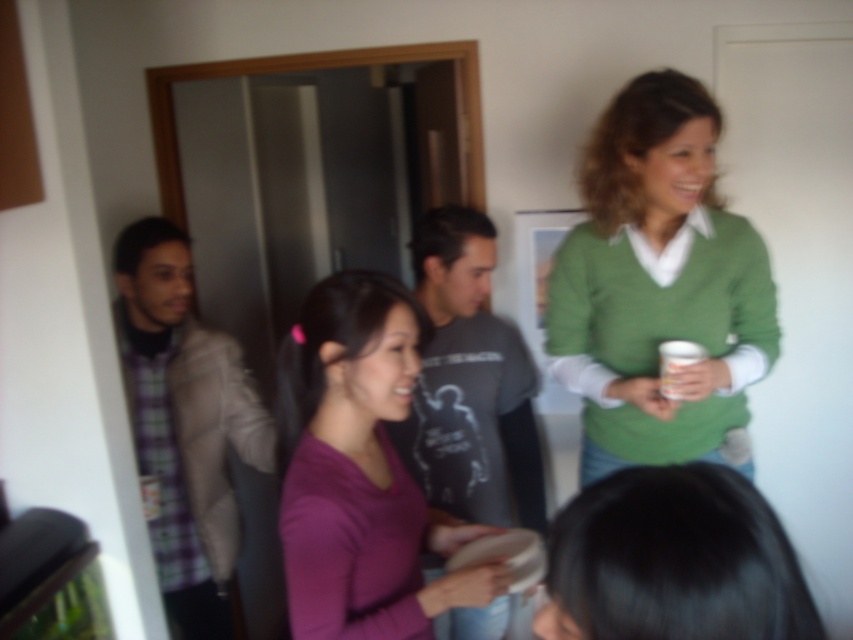
Question: Is plaid fabric shirt at left bigger than dark gray t-shirt at center?

Choices:
 (A) yes
 (B) no

Answer: (B)

Question: Which object is farther from the camera taking this photo?

Choices:
 (A) plaid fabric shirt at left
 (B) dark gray t-shirt at center
 (C) purple matte shirt at center
 (D) white paper cup at upper right

Answer: (A)

Question: Does green matte sweater at upper right come in front of purple matte shirt at center?

Choices:
 (A) no
 (B) yes

Answer: (A)

Question: Can you confirm if dark gray t-shirt at center is bigger than white paper cup at upper right?

Choices:
 (A) no
 (B) yes

Answer: (B)

Question: Which object is positioned farthest from the dark gray t-shirt at center?

Choices:
 (A) black hair at lower center
 (B) green matte sweater at upper right

Answer: (A)

Question: Which object appears farthest from the camera in this image?

Choices:
 (A) plaid fabric shirt at left
 (B) black hair at lower center
 (C) white paper cup at upper right
 (D) purple matte shirt at center

Answer: (A)